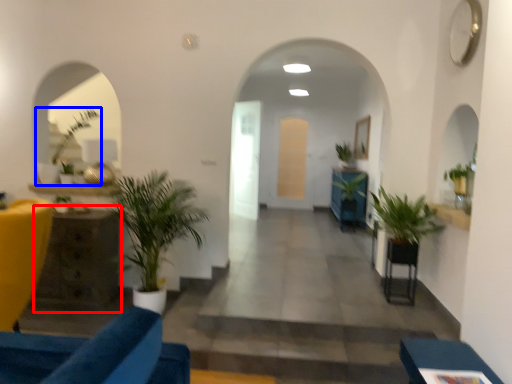
Question: Among these objects, which one is farthest to the camera, table (highlighted by a red box) or houseplant (highlighted by a blue box)?

Choices:
 (A) table
 (B) houseplant

Answer: (B)